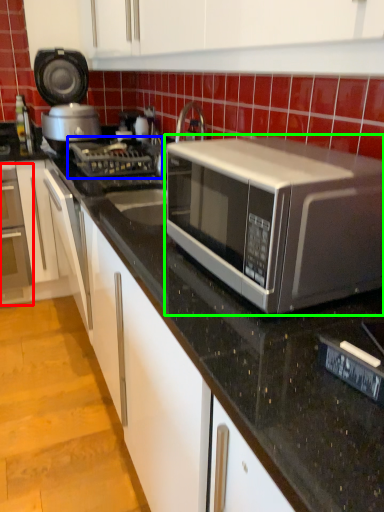
Question: Based on their relative distances, which object is farther from oven (highlighted by a red box)? Choose from gas stove (highlighted by a blue box) and microwave oven (highlighted by a green box).

Choices:
 (A) gas stove
 (B) microwave oven

Answer: (B)